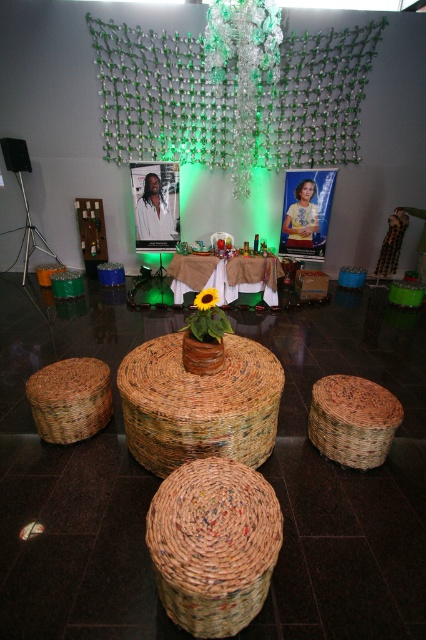
Question: Estimate the real-world distances between objects in this image. Which object is closer to the woven straw basket at lower right?

Choices:
 (A) yellow matte sunflower at center
 (B) translucent glass chandelier at upper center
 (C) brown woven basket at lower left

Answer: (A)

Question: Which of these objects is positioned closest to the brown woven basket at lower left?

Choices:
 (A) yellow matte sunflower at center
 (B) woven straw basket at center
 (C) woven straw basket at lower right
 (D) brown woven basket at center

Answer: (B)

Question: Is brown woven basket at center thinner than woven straw basket at lower right?

Choices:
 (A) no
 (B) yes

Answer: (A)

Question: Which object appears farthest from the camera in this image?

Choices:
 (A) translucent glass chandelier at upper center
 (B) brown woven basket at center

Answer: (A)

Question: Does woven straw basket at center appear over translucent glass chandelier at upper center?

Choices:
 (A) no
 (B) yes

Answer: (A)

Question: Does woven straw basket at center appear under translucent glass chandelier at upper center?

Choices:
 (A) yes
 (B) no

Answer: (A)